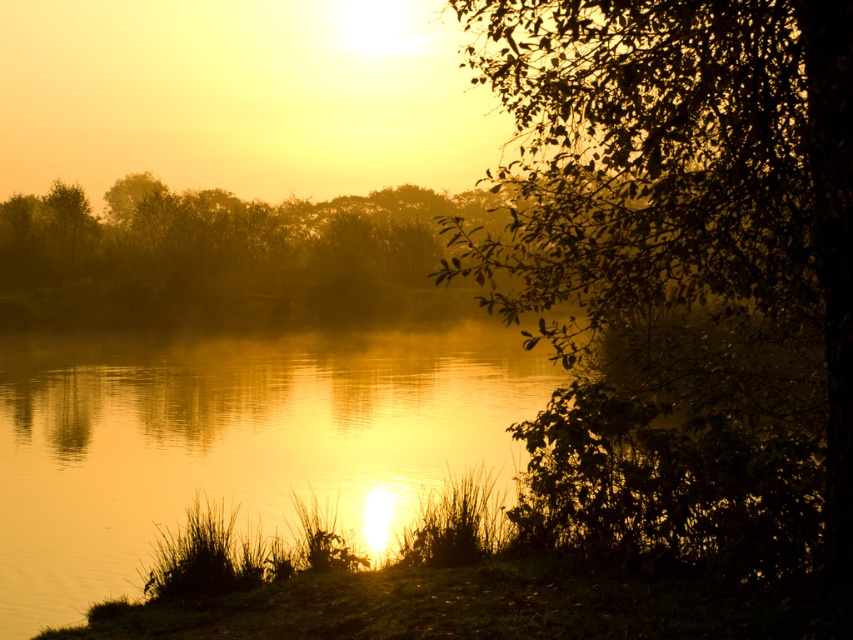
Does green leafy tree at right appear on the right side of golden reflective water at center?

Indeed, green leafy tree at right is positioned on the right side of golden reflective water at center.

Who is shorter, green leafy tree at right or golden reflective water at center?

golden reflective water at center is shorter.

Does point (566, 532) lie in front of point (225, 364)?

Yes.

Locate an element on the screen. The height and width of the screenshot is (640, 853). green leafy tree at right is located at coordinates (679, 269).